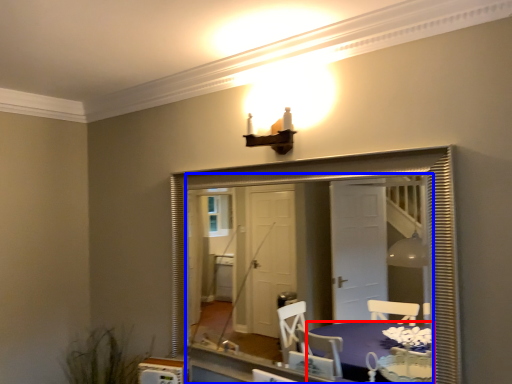
Question: Which of the following is the farthest to the observer, table (highlighted by a red box) or mirror (highlighted by a blue box)?

Choices:
 (A) table
 (B) mirror

Answer: (B)